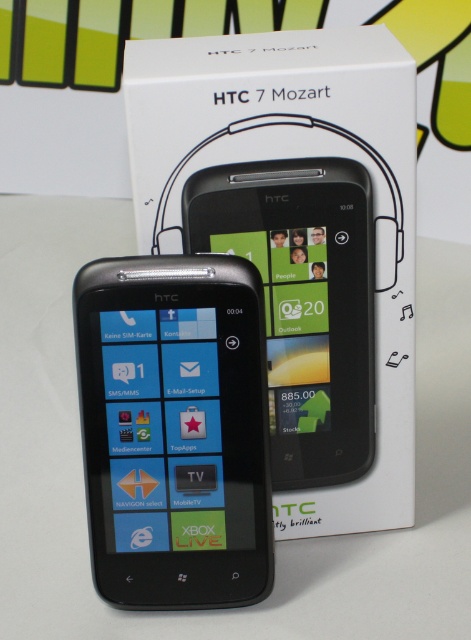
Question: Can you confirm if matte black phone at center is positioned to the right of black glossy smartphone at center?

Choices:
 (A) no
 (B) yes

Answer: (A)

Question: Estimate the real-world distances between objects in this image. Which object is farther from the matte black phone at center?

Choices:
 (A) black glossy smartphone at center
 (B) white matte htc 7 mozart box at center

Answer: (B)

Question: Is white matte htc 7 mozart box at center smaller than matte black phone at center?

Choices:
 (A) no
 (B) yes

Answer: (A)

Question: Which object is farther from the camera taking this photo?

Choices:
 (A) white matte htc 7 mozart box at center
 (B) black glossy smartphone at center
 (C) matte black phone at center

Answer: (B)

Question: Among these objects, which one is farthest from the camera?

Choices:
 (A) matte black phone at center
 (B) white matte htc 7 mozart box at center

Answer: (A)

Question: Does white matte htc 7 mozart box at center have a greater width compared to black glossy smartphone at center?

Choices:
 (A) yes
 (B) no

Answer: (A)